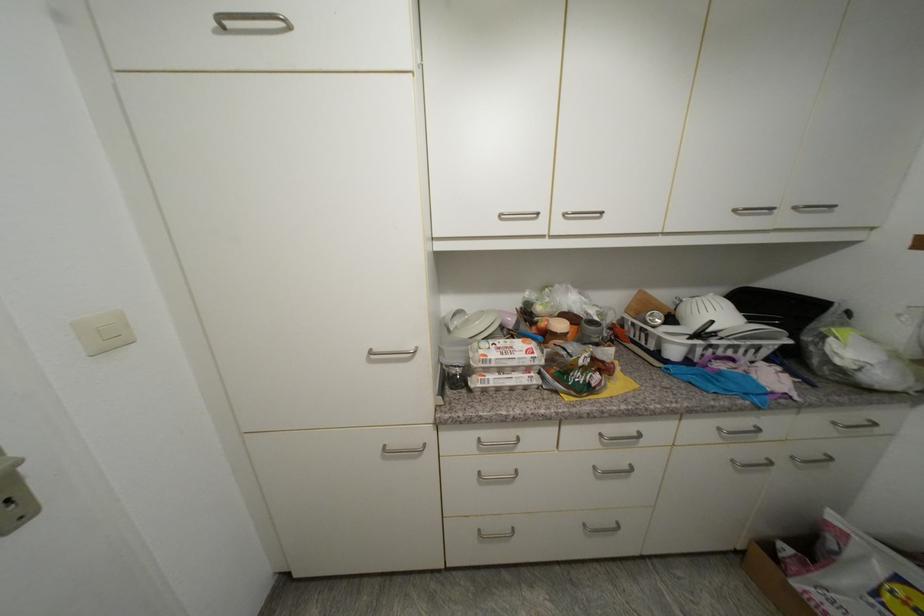
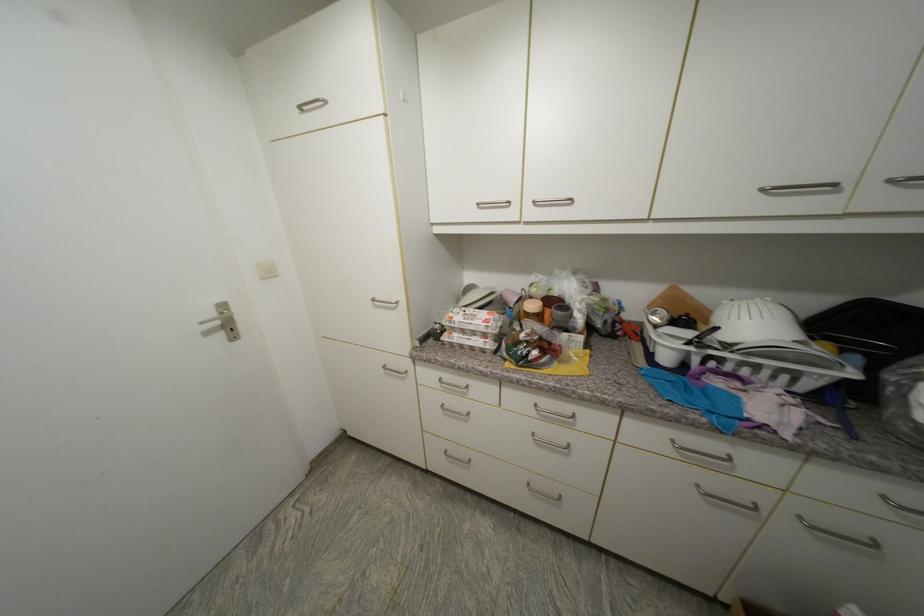
Where in the second image is the point corresponding to point 533,371 from the first image?

(490, 337)